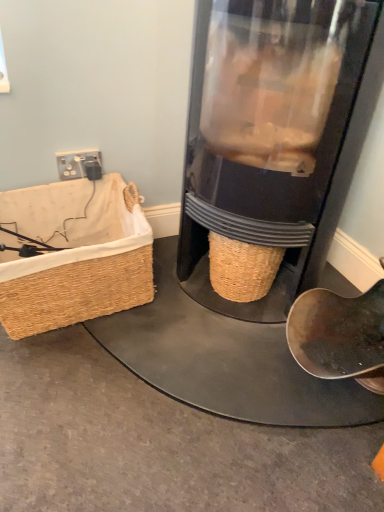
Question: Does woven straw picnic basket at left have a greater height compared to transparent plastic coffee grinder at center?

Choices:
 (A) no
 (B) yes

Answer: (A)

Question: Is woven straw picnic basket at left not near transparent plastic coffee grinder at center?

Choices:
 (A) no
 (B) yes

Answer: (A)

Question: Is transparent plastic coffee grinder at center a part of woven straw picnic basket at left?

Choices:
 (A) yes
 (B) no

Answer: (B)

Question: Considering the relative sizes of woven straw picnic basket at left and transparent plastic coffee grinder at center in the image provided, is woven straw picnic basket at left thinner than transparent plastic coffee grinder at center?

Choices:
 (A) no
 (B) yes

Answer: (B)

Question: Is woven straw picnic basket at left next to transparent plastic coffee grinder at center?

Choices:
 (A) no
 (B) yes

Answer: (A)

Question: Based on their sizes in the image, would you say transparent plastic coffee grinder at center is bigger or smaller than black plastic plug at upper left?

Choices:
 (A) big
 (B) small

Answer: (A)

Question: Is transparent plastic coffee grinder at center to the left or to the right of black plastic plug at upper left in the image?

Choices:
 (A) left
 (B) right

Answer: (B)

Question: From a real-world perspective, is transparent plastic coffee grinder at center above or below black plastic plug at upper left?

Choices:
 (A) below
 (B) above

Answer: (B)

Question: Is transparent plastic coffee grinder at center in front of or behind black plastic plug at upper left in the image?

Choices:
 (A) front
 (B) behind

Answer: (A)

Question: From the image's perspective, is woven straw picnic basket at left located above or below transparent plastic coffee grinder at center?

Choices:
 (A) below
 (B) above

Answer: (A)

Question: Is woven straw picnic basket at left taller or shorter than transparent plastic coffee grinder at center?

Choices:
 (A) short
 (B) tall

Answer: (A)

Question: Considering their positions, is woven straw picnic basket at left located in front of or behind transparent plastic coffee grinder at center?

Choices:
 (A) behind
 (B) front

Answer: (A)

Question: In terms of width, does woven straw picnic basket at left look wider or thinner when compared to transparent plastic coffee grinder at center?

Choices:
 (A) thin
 (B) wide

Answer: (A)

Question: Is point (127, 302) closer or farther from the camera than point (69, 168)?

Choices:
 (A) closer
 (B) farther

Answer: (A)

Question: Considering their positions, is woven straw picnic basket at left located in front of or behind black plastic plug at upper left?

Choices:
 (A) behind
 (B) front

Answer: (B)